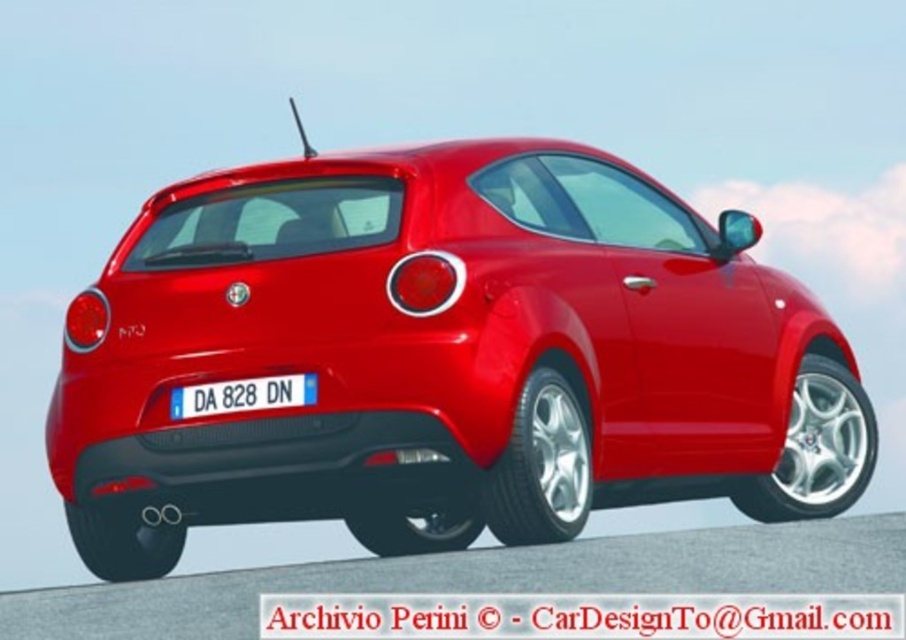
You are standing in front of the Alfa Romeo MiTo car. There is a point marked at coordinates (444,356). What does this point represent?

The point at coordinates (444,356) indicates the glossy red car at center.

You are a photographer planning to take a picture of the glossy red car at center. The car is positioned at coordinates 0.559, 0.491. You want to ensure the car is centered in your shot. What adjustment should you make to the camera frame?

The glossy red car at center is already positioned at coordinates (x=444, y=356), so no adjustment is needed to center it in the shot.

You are a photographer taking a picture of the glossy red car at center and the white plastic license plate at center. If you want to frame both objects in your shot, should you adjust your camera to the left or right to include both?

The glossy red car at center is to the right of the white plastic license plate at center. To frame both in your shot, you should adjust your camera to the left to include both the glossy red car at center and the white plastic license plate at center.